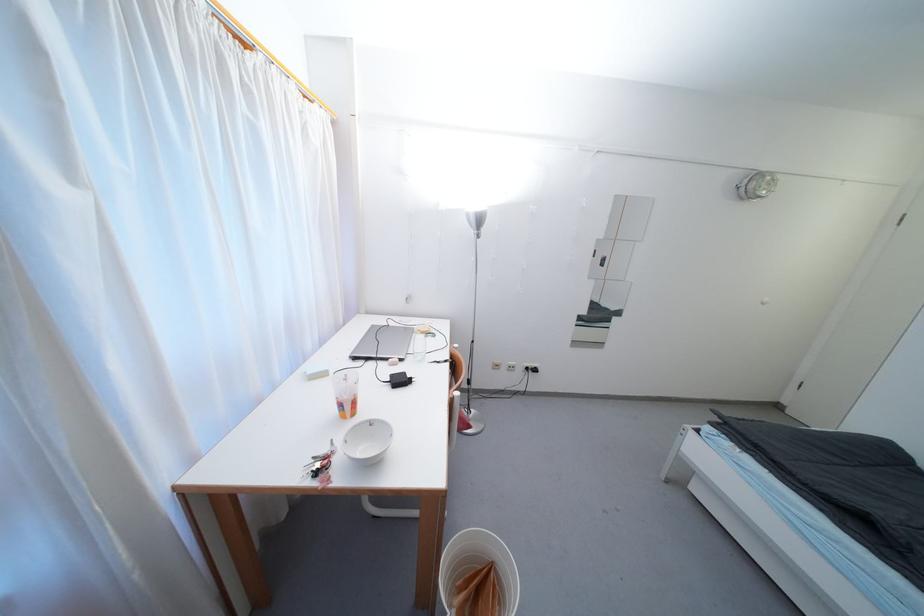
Which object does [383,342] point to?

It corresponds to the silver laptop in the image.